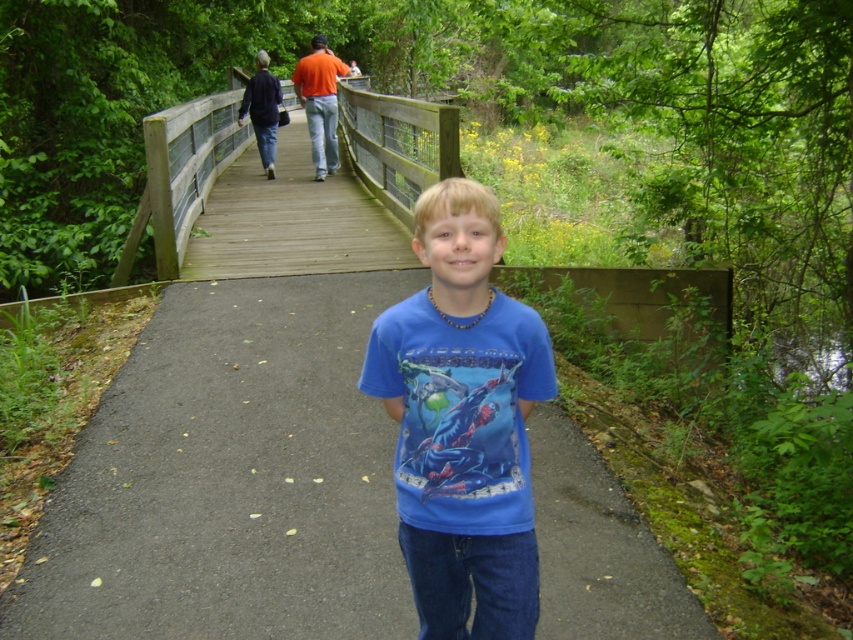
You are a photographer trying to capture both the blue cotton shirt at center and the wooden bridge at upper center in a single frame. Given their sizes, which object should you focus on to ensure both are clearly visible in your photo?

The blue cotton shirt at center is smaller than the wooden bridge at upper center. To ensure both are clearly visible, focus on the wooden bridge at upper center since it is larger and will remain in focus while the smaller shirt can be positioned within the same frame without overfilling the space.

You are a photographer standing on the paved pathway where the young boy is located. You want to take a photo that includes both the blue cotton shirt at center and the wooden bridge at upper center. Which object should you focus on first to ensure both are in sharp focus?

You should focus on the blue cotton shirt at center first because it is closer to the viewer than the wooden bridge at upper center. By focusing on the closer object, the bridge will still be within the depth of field and remain in focus.